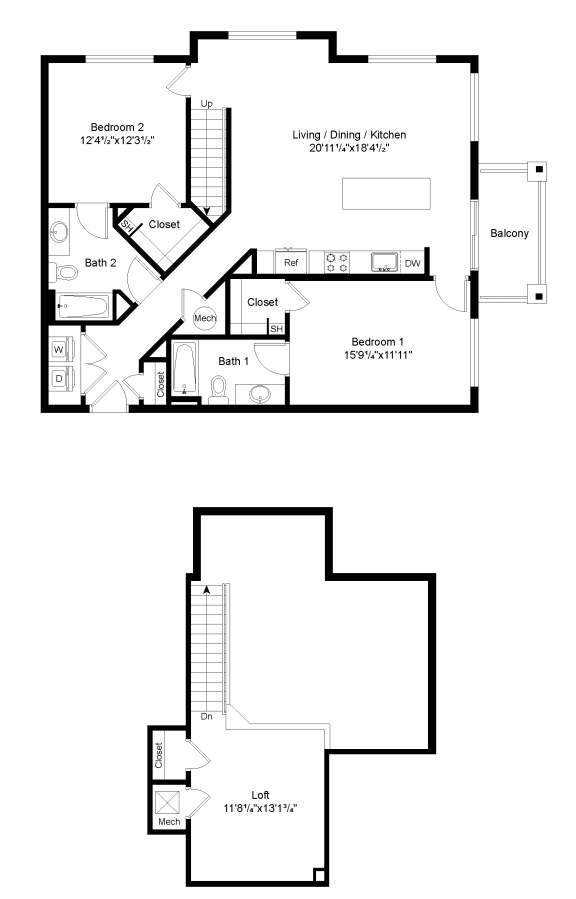
I want to click on bathtubs, so click(x=183, y=370), click(x=94, y=301).